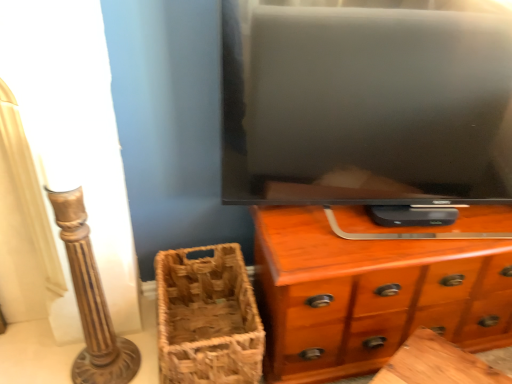
Question: Is brown woven basket at lower left to the right of wooden chest of drawers at center from the viewer's perspective?

Choices:
 (A) no
 (B) yes

Answer: (A)

Question: From a real-world perspective, is brown woven basket at lower left physically above wooden chest of drawers at center?

Choices:
 (A) yes
 (B) no

Answer: (B)

Question: Can we say brown woven basket at lower left lies outside wooden chest of drawers at center?

Choices:
 (A) yes
 (B) no

Answer: (A)

Question: Is brown woven basket at lower left bigger than wooden chest of drawers at center?

Choices:
 (A) no
 (B) yes

Answer: (A)

Question: Is brown woven basket at lower left facing towards wooden chest of drawers at center?

Choices:
 (A) yes
 (B) no

Answer: (B)

Question: From the image's perspective, is brown woven basket at lower left beneath wooden chest of drawers at center?

Choices:
 (A) no
 (B) yes

Answer: (B)

Question: From a real-world perspective, is wooden chest of drawers at center physically above brown woven basket at lower left?

Choices:
 (A) yes
 (B) no

Answer: (A)

Question: Is wooden chest of drawers at center positioned before brown woven basket at lower left?

Choices:
 (A) no
 (B) yes

Answer: (B)

Question: Is wooden chest of drawers at center further to the viewer compared to brown woven basket at lower left?

Choices:
 (A) no
 (B) yes

Answer: (A)

Question: Considering the relative sizes of wooden chest of drawers at center and brown woven basket at lower left in the image provided, is wooden chest of drawers at center wider than brown woven basket at lower left?

Choices:
 (A) yes
 (B) no

Answer: (B)

Question: From a real-world perspective, does wooden chest of drawers at center sit lower than brown woven basket at lower left?

Choices:
 (A) yes
 (B) no

Answer: (B)

Question: Is wooden chest of drawers at center at the left side of brown woven basket at lower left?

Choices:
 (A) yes
 (B) no

Answer: (B)

Question: Does point (240, 370) appear closer or farther from the camera than point (362, 357)?

Choices:
 (A) closer
 (B) farther

Answer: (A)